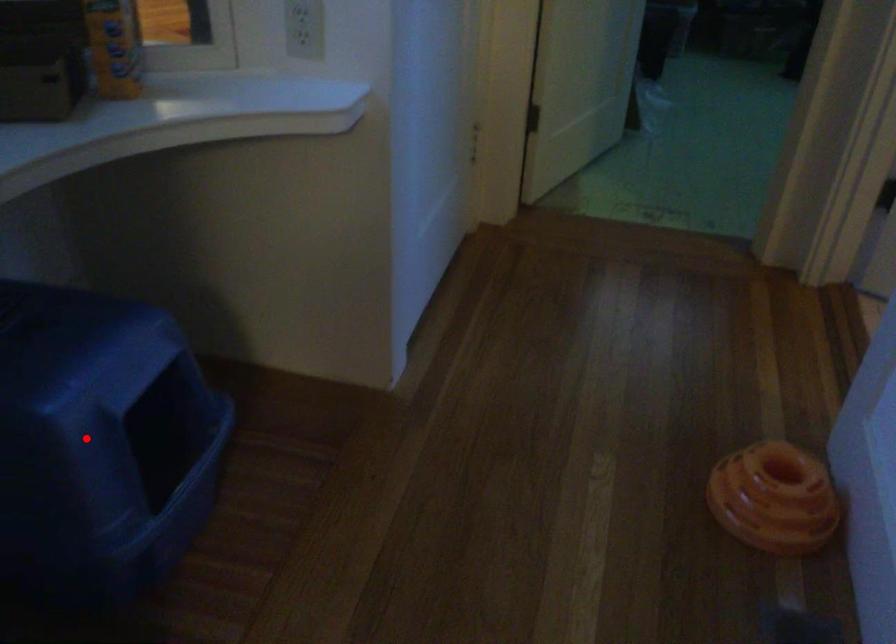
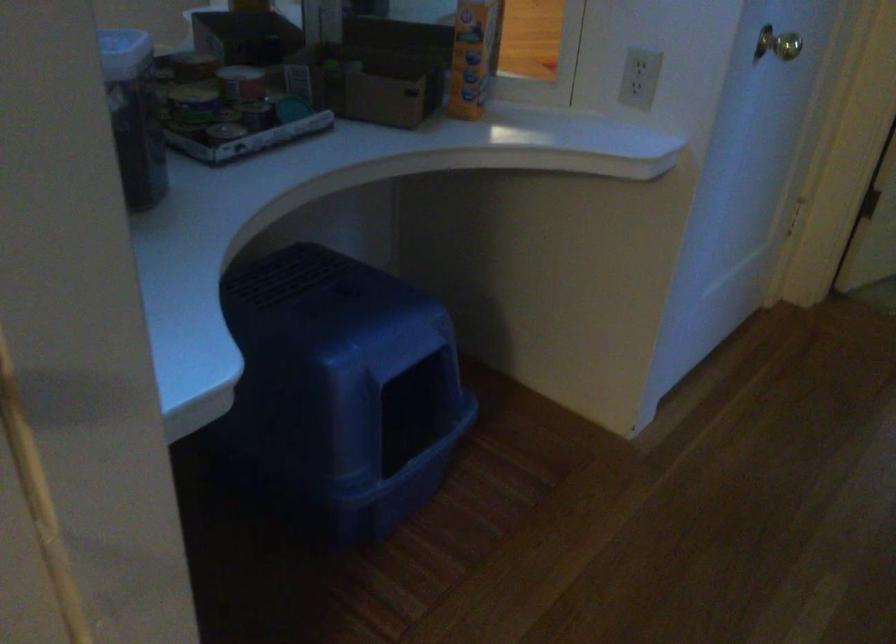
Question: I am providing you with two images of the same scene from different viewpoints. Given a red point in image1, look at the same physical point in image2. Is it:

Choices:
 (A) Closer to the viewpoint
 (B) Farther from the viewpoint

Answer: (B)